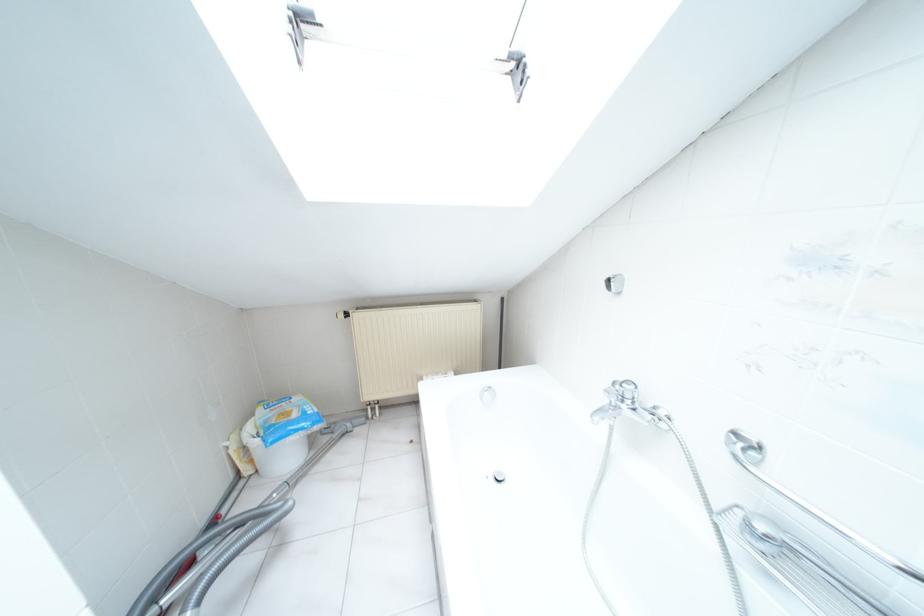
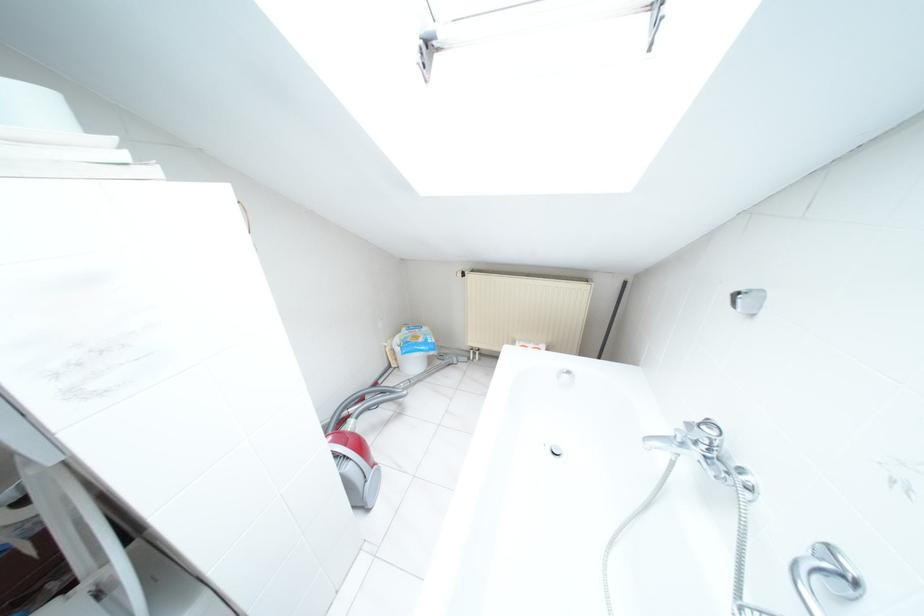
In the second image, find the point that corresponds to (294,414) in the first image.

(419, 339)